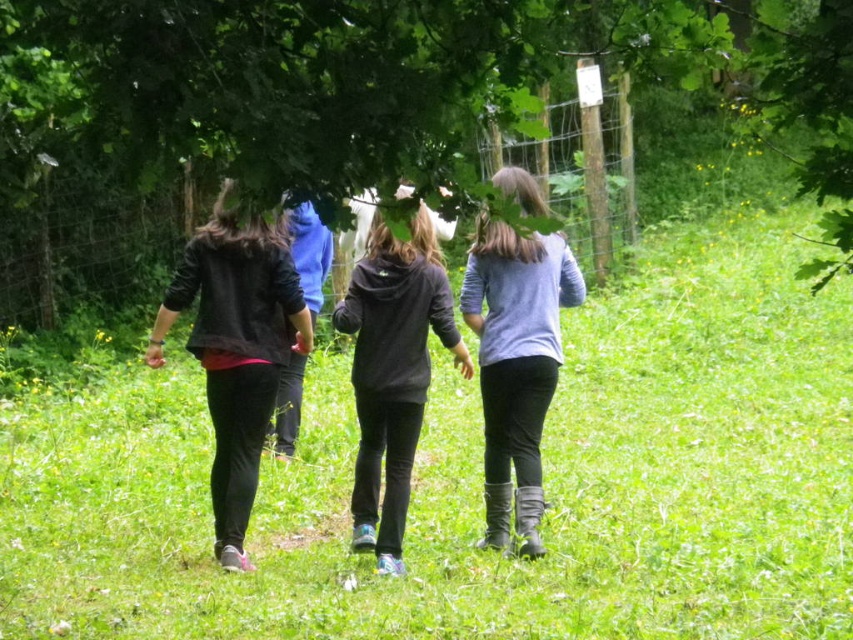
Question: From the image, what is the correct spatial relationship of green grassy at center in relation to light blue fabric jacket at center?

Choices:
 (A) left
 (B) right

Answer: (B)

Question: Does matte black jacket at left appear on the right side of dark gray hoodie at center?

Choices:
 (A) no
 (B) yes

Answer: (A)

Question: Which is nearer to the dark gray hoodie at center?

Choices:
 (A) matte black jacket at left
 (B) green grassy at center

Answer: (A)

Question: Which of the following is the farthest from the observer?

Choices:
 (A) green grassy at center
 (B) light blue fabric jacket at center

Answer: (B)

Question: Which point is closer to the camera?

Choices:
 (A) green grassy at center
 (B) green leafy tree at upper center
 (C) light blue fabric jacket at center

Answer: (B)

Question: Can you confirm if light blue fabric jacket at center is positioned to the right of dark gray hoodie at center?

Choices:
 (A) yes
 (B) no

Answer: (A)